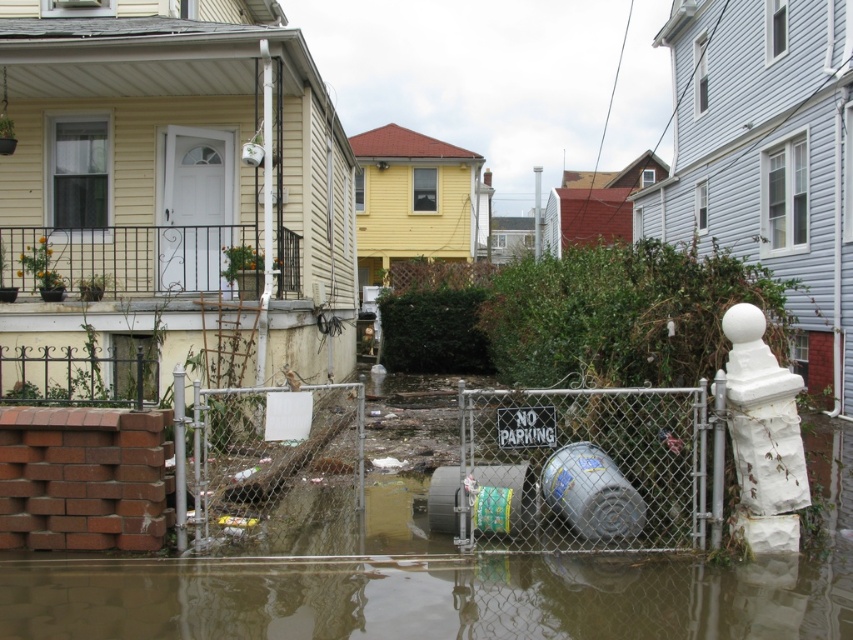
From the picture: Who is more forward, (230, 506) or (828, 636)?

Point (828, 636)

Is chain-link fence at center thinner than brown murky water at lower center?

Yes.

In the scene shown: Who is more distant from viewer, (x=260, y=387) or (x=706, y=596)?

The point (x=260, y=387) is more distant.

The image size is (853, 640). Identify the location of chain-link fence at center. (579, 470).